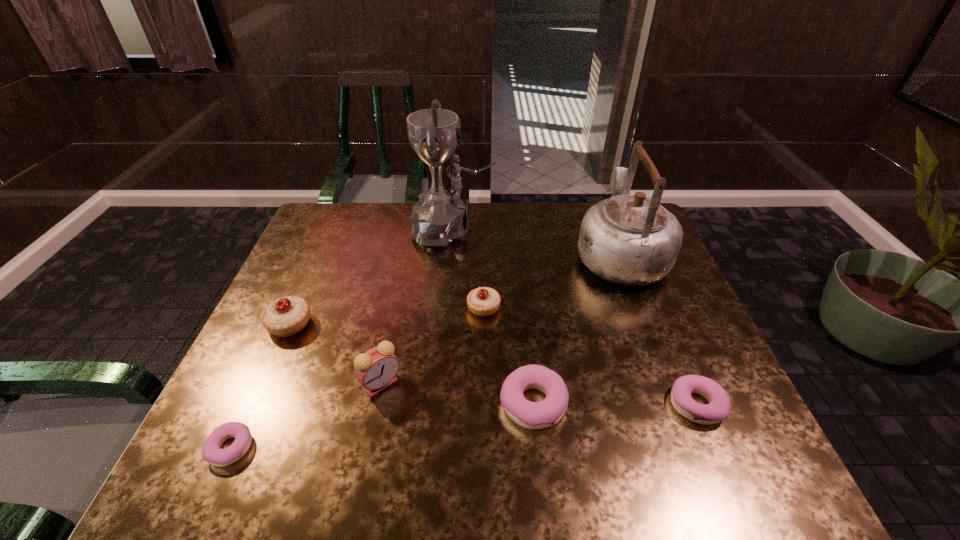
Where is `award`? award is located at coordinates (440, 217).

I want to click on kettle, so click(x=631, y=240).

Identify the location of alarm clock. (375, 369).

At what (x,y) coordinates should I click in order to perform the action: click on pink alarm clock. Please return your answer as a coordinate pair (x, y). This screenshot has width=960, height=540. Looking at the image, I should click on (375, 369).

You are a GUI agent. You are given a task and a screenshot of the screen. Output one action in this format:
    pyautogui.click(x=<x>, y=<y>)
    Task: Click on the bigger beige pastry
    This screenshot has height=540, width=960.
    Given the screenshot: What is the action you would take?
    pyautogui.click(x=287, y=316)

I want to click on the fifth shortest object, so click(x=287, y=316).

Image resolution: width=960 pixels, height=540 pixels. What are the coordinates of `the fourth shortest object` in the screenshot? It's located at (484, 301).

Locate an element on the screen. Image resolution: width=960 pixels, height=540 pixels. the right beige pastry is located at coordinates (484, 301).

At what (x,y) coordinates should I click in order to perform the action: click on the second pink pastry from left to right. Please return your answer as a coordinate pair (x, y). Looking at the image, I should click on (533, 415).

Locate an element on the screen. The width and height of the screenshot is (960, 540). the sixth tallest object is located at coordinates (533, 415).